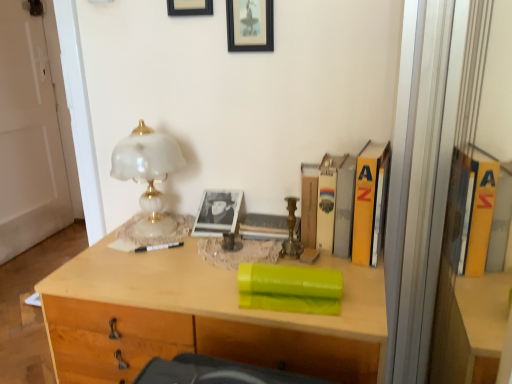
Question: Does black plastic pen at center have a lesser height compared to black framed picture at upper center, which is counted as the first picture frame, starting from the right?

Choices:
 (A) no
 (B) yes

Answer: (B)

Question: Is black plastic pen at center oriented away from black framed picture at upper center, which is counted as the first picture frame, starting from the right?

Choices:
 (A) no
 (B) yes

Answer: (A)

Question: Is black plastic pen at center at the right side of black framed picture at upper center, which appears as the 2th picture frame when viewed from the left?

Choices:
 (A) no
 (B) yes

Answer: (A)

Question: Is black plastic pen at center positioned behind black framed picture at upper center, which appears as the 2th picture frame when viewed from the left?

Choices:
 (A) no
 (B) yes

Answer: (B)

Question: Considering the relative sizes of black plastic pen at center and black framed picture at upper center, which is counted as the first picture frame, starting from the right, in the image provided, is black plastic pen at center taller than black framed picture at upper center, which is counted as the first picture frame, starting from the right,?

Choices:
 (A) no
 (B) yes

Answer: (A)

Question: Considering the positions of green matte book at center, the 2th book positioned from the right, and light wood desk at center in the image, is green matte book at center, the 2th book positioned from the right, wider or thinner than light wood desk at center?

Choices:
 (A) thin
 (B) wide

Answer: (A)

Question: From their relative heights in the image, would you say green matte book at center, which is the 1th book from front to back, is taller or shorter than light wood desk at center?

Choices:
 (A) short
 (B) tall

Answer: (A)

Question: Considering the positions of green matte book at center, which is the 1th book from front to back, and light wood desk at center in the image, is green matte book at center, which is the 1th book from front to back, bigger or smaller than light wood desk at center?

Choices:
 (A) big
 (B) small

Answer: (B)

Question: Visually, is green matte book at center, the second book when ordered from back to front, positioned to the left or to the right of light wood desk at center?

Choices:
 (A) left
 (B) right

Answer: (B)

Question: From the image's perspective, is hardcover book at upper right, the first book in the back-to-front sequence, located above or below green matte book at center, the 2th book positioned from the right?

Choices:
 (A) above
 (B) below

Answer: (A)

Question: Is point (371, 244) closer or farther from the camera than point (335, 288)?

Choices:
 (A) farther
 (B) closer

Answer: (A)

Question: Is hardcover book at upper right, arranged as the 1th book when viewed from the top, to the left or to the right of green matte book at center, the 2th book positioned from the right, in the image?

Choices:
 (A) right
 (B) left

Answer: (A)

Question: Do you think hardcover book at upper right, the second book ordered from the bottom, is within green matte book at center, the 2th book positioned from the right, or outside of it?

Choices:
 (A) inside
 (B) outside

Answer: (B)

Question: Is green matte book at center, which appears as the 1th book when ordered from the bottom, inside or outside of black matte picture frame at upper center, placed as the second picture frame when sorted from right to left?

Choices:
 (A) outside
 (B) inside

Answer: (A)

Question: Based on their sizes in the image, would you say green matte book at center, which appears as the 1th book when ordered from the bottom, is bigger or smaller than black matte picture frame at upper center, placed as the second picture frame when sorted from right to left?

Choices:
 (A) small
 (B) big

Answer: (B)